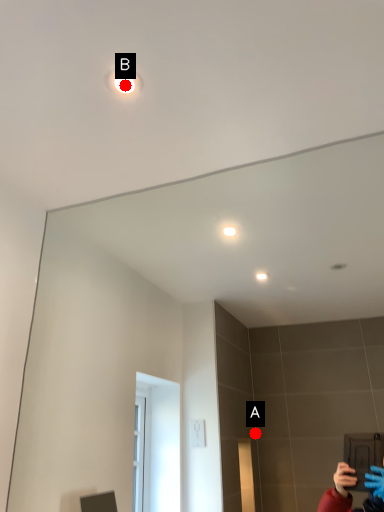
Question: Two points are circled on the image, labeled by A and B beside each circle. Which point is farther from the camera taking this photo?

Choices:
 (A) A is further
 (B) B is further

Answer: (A)